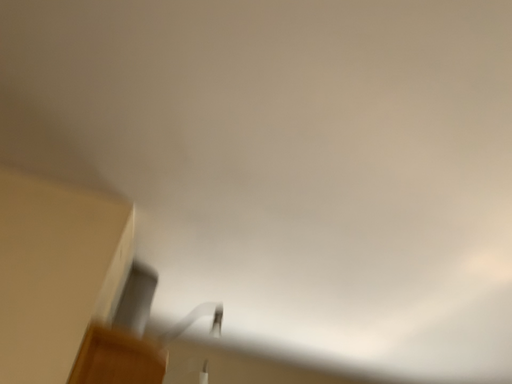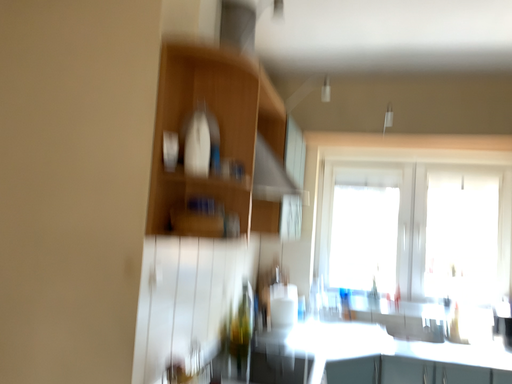
Question: Which way did the camera rotate in the video?

Choices:
 (A) rotated right
 (B) rotated left

Answer: (B)